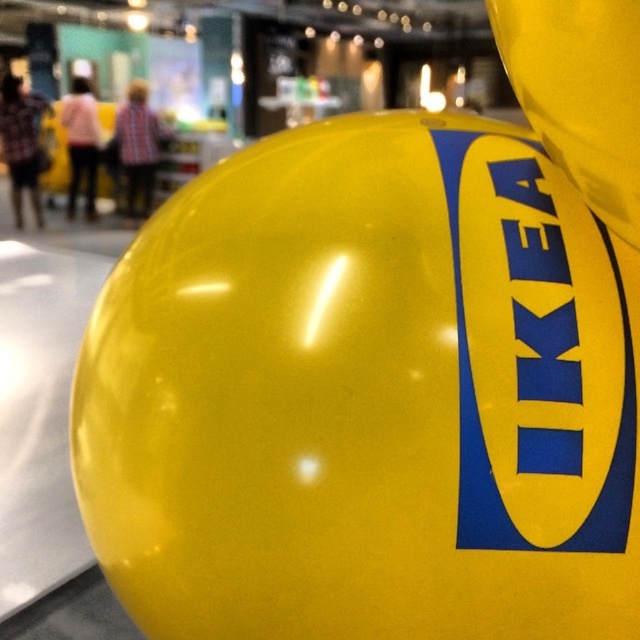
You are at IKEA and see the yellow rubber balloon at center and the yellow glossy ikea logo at center. Which one is positioned to the left?

The yellow rubber balloon at center is positioned to the left of the yellow glossy ikea logo at center.

You are standing in the IKEA store and see two points marked in the image. Which point is closer to you, point (x=465, y=484) or point (x=612, y=100)?

Point (x=465, y=484) is closer to you than point (x=612, y=100) because it is further to the viewer in the image.

You are holding a camera and want to take a photo of the bright yellow balloon with the word IKEA printed in bold blue letters. The camera has a focus point at position point (236, 504). Is this focus point within the balloon?

The point (236, 504) is 30.70 inches away from viewer, so it is within the balloon since the balloon occupies most of the frame.